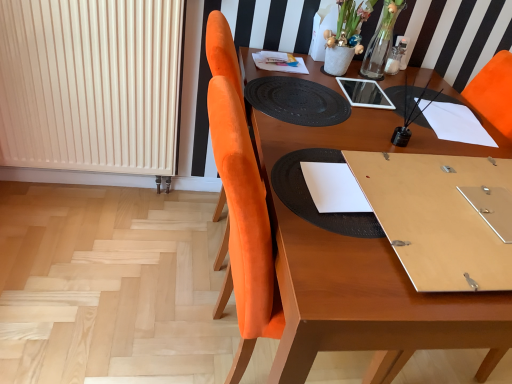
At what (x,y) coordinates should I click in order to perform the action: click on wooden table at center. Please return your answer as a coordinate pair (x, y). This screenshot has height=384, width=512. Looking at the image, I should click on (370, 305).

What do you see at coordinates (297, 101) in the screenshot? I see `black textured placemat at center` at bounding box center [297, 101].

I want to click on wooden table at center, so click(370, 305).

Between wooden table at center and white ribbed radiator at left, which one is positioned in front?

wooden table at center is more forward.

From the image's perspective, would you say wooden table at center is positioned over white ribbed radiator at left?

No, from the image's perspective, wooden table at center is not above white ribbed radiator at left.

Between point (382, 130) and point (104, 133), which one is positioned behind?

The point (104, 133) is more distant.

Choose the correct answer: Is wooden table at center inside white ribbed radiator at left or outside it?

wooden table at center is located beyond the bounds of white ribbed radiator at left.

Based on their positions, is white ribbed radiator at left located to the left or right of white matte vase at upper center?

Clearly, white ribbed radiator at left is on the left of white matte vase at upper center in the image.

Which is correct: white ribbed radiator at left is inside white matte vase at upper center, or outside of it?

white ribbed radiator at left is not inside white matte vase at upper center, it's outside.

Considering the relative sizes of white ribbed radiator at left and white matte vase at upper center in the image provided, is white ribbed radiator at left wider than white matte vase at upper center?

No.

Does point (326, 171) come behind point (259, 90)?

No.

From the image's perspective, does white paper at center appear lower than black textured placemat at center?

Yes, from the image's perspective, white paper at center is below black textured placemat at center.

In terms of height, does white paper at center look taller or shorter compared to black textured placemat at center?

Considering their sizes, white paper at center has more height than black textured placemat at center.

From the image's perspective, which object appears higher, white ribbed radiator at left or black textured placemat at center?

white ribbed radiator at left appears higher in the image.

Considering the sizes of objects white ribbed radiator at left and black textured placemat at center in the image provided, who is wider, white ribbed radiator at left or black textured placemat at center?

black textured placemat at center is wider.

Visually, is white ribbed radiator at left positioned to the left or to the right of black textured placemat at center?

In the image, white ribbed radiator at left appears on the left side of black textured placemat at center.

Does point (335, 43) appear closer or farther from the camera than point (324, 329)?

Clearly, point (335, 43) is more distant from the camera than point (324, 329).

Is white matte vase at upper center wider than wooden table at center?

No, white matte vase at upper center is not wider than wooden table at center.

From the image's perspective, which one is positioned lower, white matte vase at upper center or wooden table at center?

wooden table at center, from the image's perspective.

From a real-world perspective, who is located higher, white matte vase at upper center or wooden table at center?

white matte vase at upper center, from a real-world perspective.

How many degrees apart are the facing directions of black textured placemat at center and wooden table at center?

They differ by 89.6 degrees in their facing directions.

Which object is further away from the camera taking this photo, black textured placemat at center or wooden table at center?

black textured placemat at center is more distant.

Would you say black textured placemat at center is to the left or to the right of wooden table at center in the picture?

Clearly, black textured placemat at center is on the left of wooden table at center in the image.

Considering the sizes of objects black textured placemat at center and wooden table at center in the image provided, who is taller, black textured placemat at center or wooden table at center?

With more height is wooden table at center.

From a real-world perspective, is white matte vase at upper center located beneath black textured placemat at center?

Incorrect, from a real-world perspective, white matte vase at upper center is higher than black textured placemat at center.

Image resolution: width=512 pixels, height=384 pixels. Find the location of `flower above the black textured placemat at center (from the image's perspective)`. flower above the black textured placemat at center (from the image's perspective) is located at coordinates (349, 24).

Based on the photo, is white matte vase at upper center placed right next to black textured placemat at center?

No, white matte vase at upper center is not making contact with black textured placemat at center.

Where is `round table that is in front of the white ribbed radiator at left`? Image resolution: width=512 pixels, height=384 pixels. round table that is in front of the white ribbed radiator at left is located at coordinates (370, 305).

Where is `radiator that is on the left side of white matte vase at upper center`? radiator that is on the left side of white matte vase at upper center is located at coordinates (90, 85).

Looking at the image, which one is located further to wooden table at center, white matte vase at upper center or white ribbed radiator at left?

Based on the image, white ribbed radiator at left appears to be further to wooden table at center.

From the image, which object appears to be nearer to wooden table at center, white ribbed radiator at left or white paper at center?

white paper at center is closer to wooden table at center.

Considering their positions, is black textured placemat at center positioned further to white matte vase at upper center than wooden table at center?

The object further to white matte vase at upper center is black textured placemat at center.

Looking at this image, considering their positions, is white paper at center positioned further to black textured placemat at center than white ribbed radiator at left?

white ribbed radiator at left.

Which object lies nearer to the anchor point white matte vase at upper center, wooden table at center or black textured placemat at center?

The object closer to white matte vase at upper center is wooden table at center.

Considering their positions, is black textured placemat at center positioned further to white matte vase at upper center than white ribbed radiator at left?

Based on the image, white ribbed radiator at left appears to be further to white matte vase at upper center.

Estimate the real-world distances between objects in this image. Which object is further from white ribbed radiator at left, black textured placemat at center or black textured placemat at center?

black textured placemat at center.

Which object lies further to the anchor point white paper at center, white ribbed radiator at left or wooden table at center?

white ribbed radiator at left lies further to white paper at center than the other object.

Find the location of `place mat positioned between wooden table at center and black textured placemat at center from near to far`. place mat positioned between wooden table at center and black textured placemat at center from near to far is located at coordinates (312, 199).

Find the location of a particular element. notebook positioned between wooden table at center and black textured placemat at center from near to far is located at coordinates (334, 188).

You are a GUI agent. You are given a task and a screenshot of the screen. Output one action in this format:
    pyautogui.click(x=<x>, y=<y>)
    Task: Click on the mat located between wooden table at center and white matte vase at upper center in the depth direction
    The image size is (512, 384).
    Given the screenshot: What is the action you would take?
    pyautogui.click(x=297, y=101)

At what (x,y) coordinates should I click in order to perform the action: click on place mat between white ribbed radiator at left and white paper at center from left to right. Please return your answer as a coordinate pair (x, y). This screenshot has width=512, height=384. Looking at the image, I should click on (312, 199).